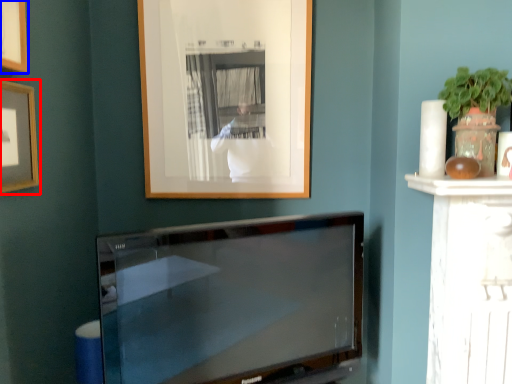
Question: Which object is closer to the camera taking this photo, picture frame (highlighted by a red box) or picture frame (highlighted by a blue box)?

Choices:
 (A) picture frame
 (B) picture frame

Answer: (B)